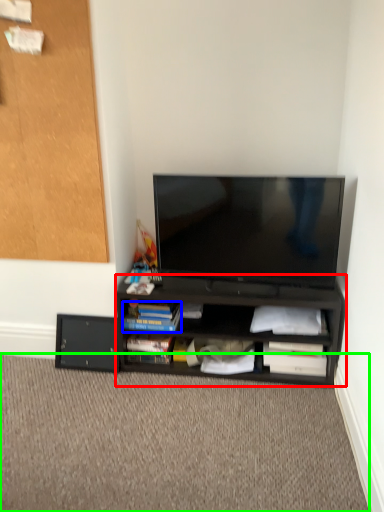
Question: Based on their relative distances, which object is nearer to desk (highlighted by a red box)? Choose from paperback book (highlighted by a blue box) and plain (highlighted by a green box).

Choices:
 (A) paperback book
 (B) plain

Answer: (A)